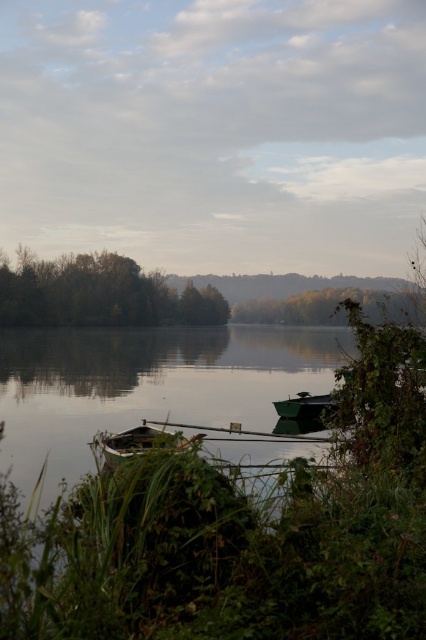
Is point (293, 316) positioned behind point (180, 433)?

Yes, it is.

Which of these two, green leafy tree at center or wooden boat at center, stands taller?

Standing taller between the two is green leafy tree at center.

Who is more distant from viewer, (371, 304) or (115, 433)?

Positioned behind is point (115, 433).

Find the location of `green leafy tree at center`. green leafy tree at center is located at coordinates (328, 307).

Is wooden boat at center taller than green wooden boat at right?

No.

Which of these two, wooden boat at center or green wooden boat at right, stands shorter?

With less height is wooden boat at center.

What do you see at coordinates (135, 444) in the screenshot? Image resolution: width=426 pixels, height=640 pixels. I see `wooden boat at center` at bounding box center [135, 444].

This screenshot has height=640, width=426. In order to click on wooden boat at center in this screenshot , I will do `click(135, 444)`.

Between green leafy trees at left and green leafy tree at center, which one has less height?

green leafy tree at center is shorter.

In the scene shown: Measure the distance between green leafy trees at left and camera.

green leafy trees at left and camera are 305.45 feet apart from each other.

Identify the location of green leafy trees at left. This screenshot has height=640, width=426. (98, 292).